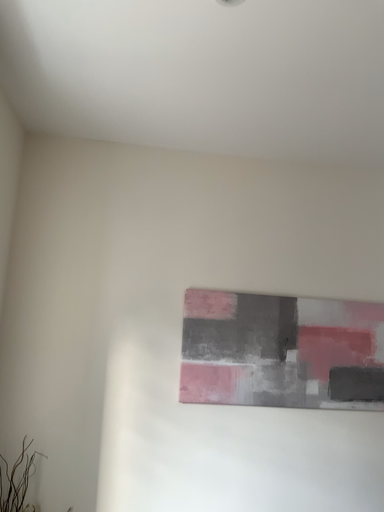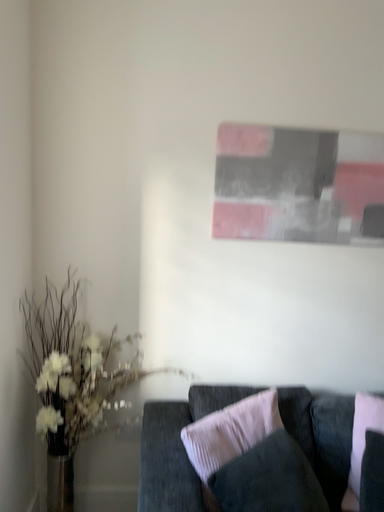
Question: How did the camera likely rotate when shooting the video?

Choices:
 (A) rotated downward
 (B) rotated upward

Answer: (A)